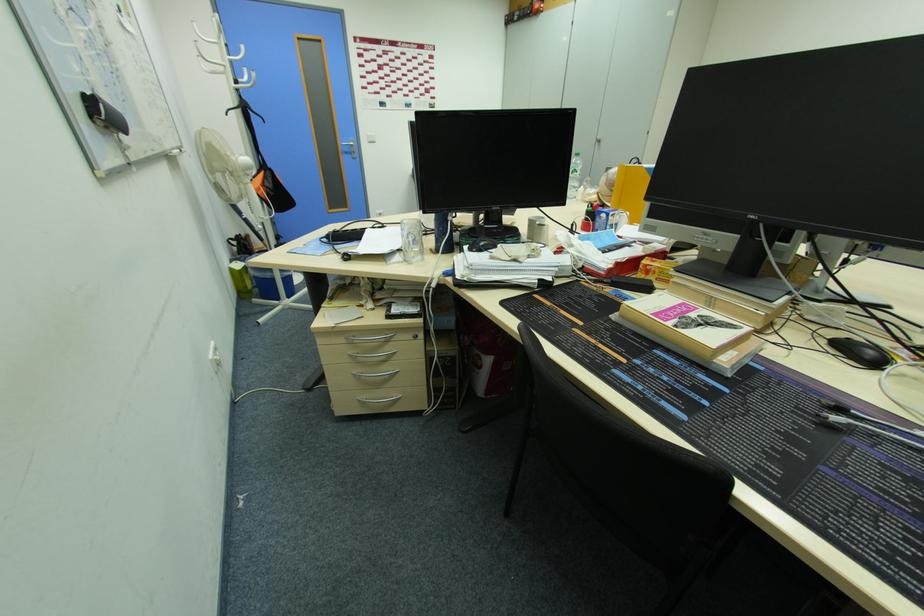
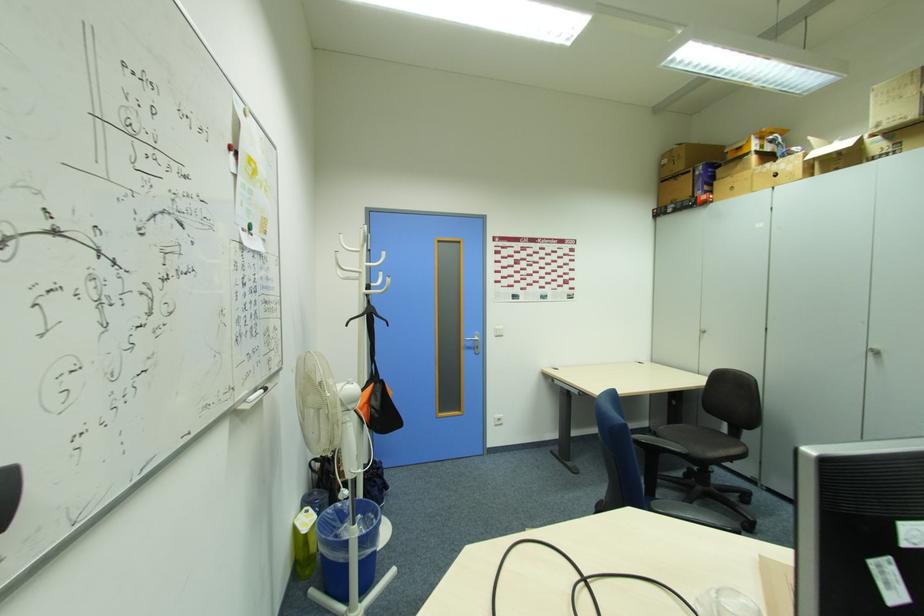
The point at (x=349, y=151) is marked in the first image. Where is the corresponding point in the second image?

(472, 346)